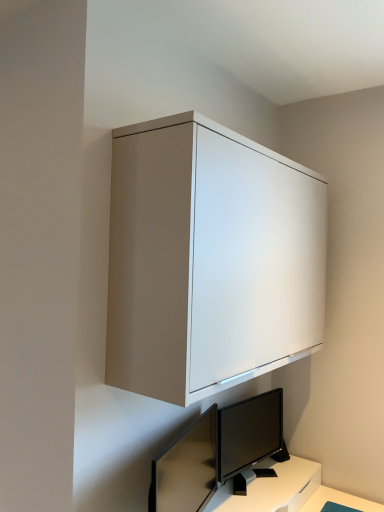
Question: From the image's perspective, is matte black monitor at lower center, which is the 2th computer monitor from right to left, above or below matte white cabinet at upper center?

Choices:
 (A) below
 (B) above

Answer: (A)

Question: Looking at their shapes, would you say matte black monitor at lower center, which is the second computer monitor in back-to-front order, is wider or thinner than matte white cabinet at upper center?

Choices:
 (A) wide
 (B) thin

Answer: (B)

Question: Which of these objects is positioned farthest from the matte black monitor at lower center, which is the second computer monitor in back-to-front order?

Choices:
 (A) black glossy monitor at lower center, the first computer monitor from the right
 (B) matte white cabinet at upper center

Answer: (B)

Question: Based on their relative distances, which object is farther from the matte black monitor at lower center, which is the second computer monitor in back-to-front order?

Choices:
 (A) black glossy monitor at lower center, which is the 1th computer monitor from back to front
 (B) matte white cabinet at upper center

Answer: (B)